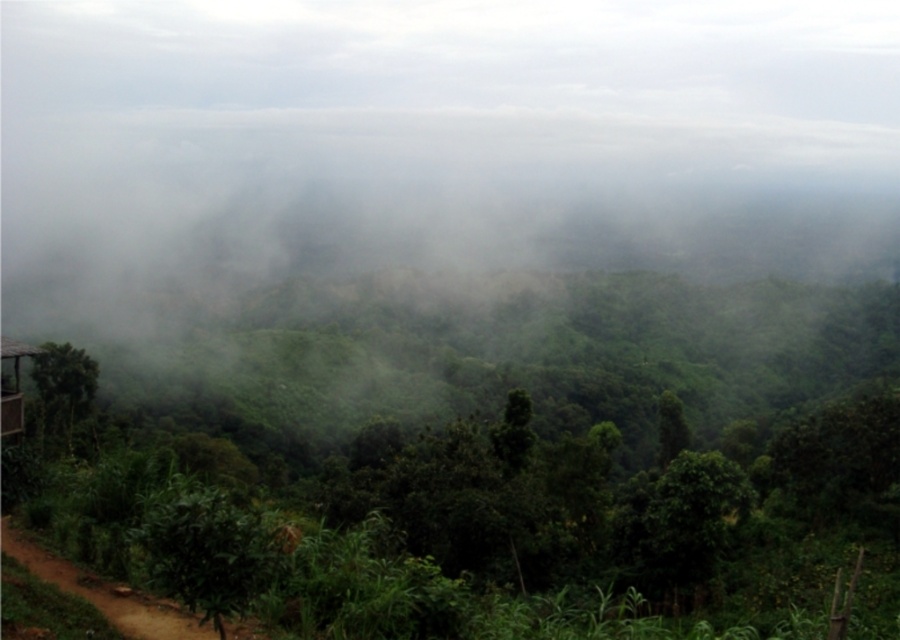
Question: From the image, what is the correct spatial relationship of green leafy tree at lower left in relation to green leafy tree at center?

Choices:
 (A) left
 (B) right

Answer: (A)

Question: Which point is closer to the camera taking this photo?

Choices:
 (A) (63, 419)
 (B) (547, 236)
 (C) (666, 424)

Answer: (C)

Question: Is green matte fog at center thinner than green leafy tree at lower left?

Choices:
 (A) yes
 (B) no

Answer: (B)

Question: Which of these objects is positioned closest to the green leafy tree at center?

Choices:
 (A) green leafy tree at lower left
 (B) green matte fog at center

Answer: (A)

Question: Which object appears farthest from the camera in this image?

Choices:
 (A) green leafy tree at lower left
 (B) green matte fog at center

Answer: (B)

Question: Does green matte fog at center have a greater width compared to green leafy tree at center?

Choices:
 (A) yes
 (B) no

Answer: (A)